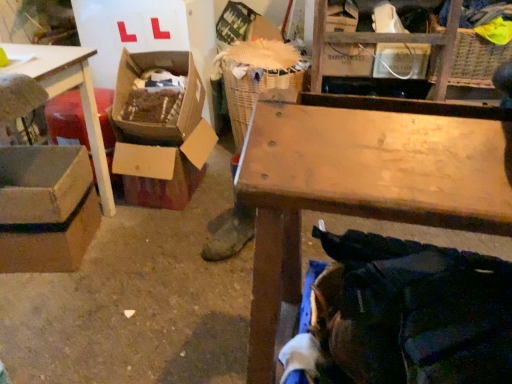
The width and height of the screenshot is (512, 384). In order to click on gray cardboard box at lower left, which is counted as the 2th box, starting from the right in this screenshot , I will do `click(46, 208)`.

At what (x,y) coordinates should I click in order to perform the action: click on wooden crate at upper center. Please return your answer as a coordinate pair (x, y). The image size is (512, 384). Looking at the image, I should click on (386, 42).

Find the location of a particular element. gray cardboard box at lower left, which is counted as the 2th box, starting from the right is located at coordinates (46, 208).

You are a GUI agent. You are given a task and a screenshot of the screen. Output one action in this format:
    pyautogui.click(x=<x>, y=<y>)
    Task: Click on the box that is the 2nd object directly below the woven straw laundry basket at center (from a real-world perspective)
    
    Given the screenshot: What is the action you would take?
    pyautogui.click(x=164, y=169)

From a real-world perspective, is woven straw laundry basket at center under cardboard box at center-left, the 2th box when ordered from left to right?

Incorrect, from a real-world perspective, woven straw laundry basket at center is higher than cardboard box at center-left, the 2th box when ordered from left to right.

Considering the sizes of objects woven straw laundry basket at center and cardboard box at center-left, marked as the 1th box in a right-to-left arrangement, in the image provided, who is wider, woven straw laundry basket at center or cardboard box at center-left, marked as the 1th box in a right-to-left arrangement,?

woven straw laundry basket at center is wider.

From the image's perspective, is woven straw laundry basket at center below cardboard box at center-left, marked as the 1th box in a right-to-left arrangement?

Incorrect, from the image's perspective, woven straw laundry basket at center is higher than cardboard box at center-left, marked as the 1th box in a right-to-left arrangement.

Relative to gray cardboard box at lower left, the first box in the left-to-right sequence, is cardboard box at left in front or behind?

cardboard box at left is behind gray cardboard box at lower left, the first box in the left-to-right sequence.

There is a cardboard box at left. Where is `the 2nd box below it (from the image's perspective)`? The height and width of the screenshot is (384, 512). the 2nd box below it (from the image's perspective) is located at coordinates (46, 208).

From the image's perspective, does cardboard box at left appear lower than gray cardboard box at lower left, the first box in the left-to-right sequence?

No.

Considering the relative positions of cardboard box at left and wooden crate at upper center in the image provided, is cardboard box at left to the left or to the right of wooden crate at upper center?

In the image, cardboard box at left appears on the left side of wooden crate at upper center.

Is cardboard box at left taller than wooden crate at upper center?

In fact, cardboard box at left may be shorter than wooden crate at upper center.

From a real-world perspective, which object rests below the other?

woven straw laundry basket at center is physically lower.

Is wooden crate at upper center further to camera compared to woven straw laundry basket at center?

That is False.

Is point (329, 41) positioned in front of point (232, 98)?

Yes.

From the picture: Which object is thinner, wooden crate at upper center or woven straw laundry basket at center?

With smaller width is wooden crate at upper center.

From the picture: Considering the relative sizes of wooden crate at upper center and wooden table at center in the image provided, is wooden crate at upper center thinner than wooden table at center?

Indeed, wooden crate at upper center has a lesser width compared to wooden table at center.

Is wooden crate at upper center to the left or to the right of wooden table at center in the image?

In the image, wooden crate at upper center appears on the right side of wooden table at center.

Which is nearer, [442,43] or [435,133]?

The point [435,133] is closer to the camera.

Considering the sizes of objects wooden crate at upper center and wooden table at center in the image provided, who is taller, wooden crate at upper center or wooden table at center?

Standing taller between the two is wooden table at center.

Which object is further away from the camera taking this photo, cardboard box at left or cardboard box at center-left, marked as the 1th box in a right-to-left arrangement?

cardboard box at center-left, marked as the 1th box in a right-to-left arrangement, is further from the camera.

From the image's perspective, which is above, cardboard box at left or cardboard box at center-left, marked as the 1th box in a right-to-left arrangement?

From the image's view, cardboard box at left is above.

Is cardboard box at left positioned far away from cardboard box at center-left, the 2th box when ordered from left to right?

Actually, cardboard box at left and cardboard box at center-left, the 2th box when ordered from left to right, are a little close together.

Which is nearer, (164, 60) or (163, 170)?

Point (164, 60) is farther from the camera than point (163, 170).

From a real-world perspective, who is located higher, wooden crate at upper center or cardboard box at left?

wooden crate at upper center, from a real-world perspective.

Is wooden crate at upper center positioned in front of cardboard box at left?

No, wooden crate at upper center is further to the viewer.

Can you tell me how much wooden crate at upper center and cardboard box at left differ in facing direction?

3.89 degrees separate the facing orientations of wooden crate at upper center and cardboard box at left.

In the scene shown: Which of these two, wooden crate at upper center or cardboard box at left, is wider?

With larger width is cardboard box at left.

From the image's perspective, starting from the woven straw laundry basket at center, which box is the 1st one below? Please provide its 2D coordinates.

[(164, 169)]

Where is `storage box above the gray cardboard box at lower left, which is counted as the 2th box, starting from the right (from the image's perspective)`? The height and width of the screenshot is (384, 512). storage box above the gray cardboard box at lower left, which is counted as the 2th box, starting from the right (from the image's perspective) is located at coordinates (170, 71).

Looking at the image, which one is located further to cardboard box at left, gray cardboard box at lower left, which is counted as the 2th box, starting from the right, or cardboard box at center-left, marked as the 1th box in a right-to-left arrangement?

gray cardboard box at lower left, which is counted as the 2th box, starting from the right, lies further to cardboard box at left than the other object.

From the image, which object appears to be farther from wooden crate at upper center, woven straw laundry basket at center or cardboard box at center-left, the 2th box when ordered from left to right?

Based on the image, cardboard box at center-left, the 2th box when ordered from left to right, appears to be further to wooden crate at upper center.

When comparing their distances from cardboard box at left, does woven straw laundry basket at center or wooden crate at upper center seem closer?

woven straw laundry basket at center is positioned closer to the anchor cardboard box at left.

Considering their positions, is wooden crate at upper center positioned closer to wooden table at center than gray cardboard box at lower left, the first box in the left-to-right sequence?

gray cardboard box at lower left, the first box in the left-to-right sequence, is positioned closer to the anchor wooden table at center.

Which object lies further to the anchor point wooden table at center, woven straw laundry basket at center or cardboard box at center-left, the 2th box when ordered from left to right?

woven straw laundry basket at center is further to wooden table at center.

Based on their spatial positions, is wooden crate at upper center or cardboard box at left closer to cardboard box at center-left, the 2th box when ordered from left to right?

cardboard box at left is positioned closer to the anchor cardboard box at center-left, the 2th box when ordered from left to right.

In the scene shown: Estimate the real-world distances between objects in this image. Which object is closer to woven straw laundry basket at center, cardboard box at center-left, marked as the 1th box in a right-to-left arrangement, or gray cardboard box at lower left, which is counted as the 2th box, starting from the right?

Based on the image, cardboard box at center-left, marked as the 1th box in a right-to-left arrangement, appears to be nearer to woven straw laundry basket at center.

Based on their spatial positions, is wooden table at center or wooden crate at upper center further from woven straw laundry basket at center?

wooden table at center.

The width and height of the screenshot is (512, 384). I want to click on box located between gray cardboard box at lower left, the first box in the left-to-right sequence, and woven straw laundry basket at center in the left-right direction, so click(x=164, y=169).

The height and width of the screenshot is (384, 512). In order to click on box between wooden table at center and cardboard box at center-left, marked as the 1th box in a right-to-left arrangement, from front to back in this screenshot , I will do `click(46, 208)`.

Locate an element on the screen. This screenshot has width=512, height=384. storage box between wooden table at center and cardboard box at center-left, marked as the 1th box in a right-to-left arrangement, from front to back is located at coordinates (170, 71).

Identify the location of storage box between gray cardboard box at lower left, which is counted as the 2th box, starting from the right, and wooden table at center, in the horizontal direction. (170, 71).